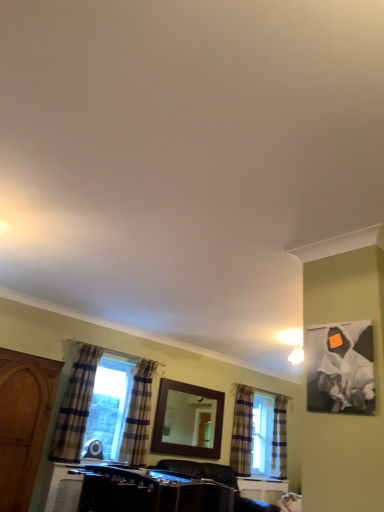
What is the approximate height of plaid fabric curtain at right, which ranks as the 4th curtain in left-to-right order?

4.26 feet.

What do you see at coordinates (340, 368) in the screenshot? I see `black canvas painting at upper right` at bounding box center [340, 368].

In order to face plaid fabric curtain at right, acting as the 3th curtain starting from the front, should I rotate leftwards or rightwards?

You should look right and rotate roughly 6.992 degrees.

I want to click on wooden mirror at center, so click(x=189, y=420).

The width and height of the screenshot is (384, 512). What do you see at coordinates (23, 422) in the screenshot?
I see `wooden cabinet at left` at bounding box center [23, 422].

Describe the element at coordinates (133, 490) in the screenshot. I see `black glossy vanity at lower center` at that location.

Where is `plaid fabric curtain at right, acting as the 1th curtain starting from the right`? Image resolution: width=384 pixels, height=512 pixels. plaid fabric curtain at right, acting as the 1th curtain starting from the right is located at coordinates (279, 438).

Which of these two, plaid fabric curtain at left, which is the 4th curtain in back-to-front order, or wooden cabinet at left, stands taller?

Answer: wooden cabinet at left is taller.

Considering the sizes of plaid fabric curtain at left, which ranks as the first curtain in front-to-back order, and wooden cabinet at left in the image, is plaid fabric curtain at left, which ranks as the first curtain in front-to-back order, wider or thinner than wooden cabinet at left?

Considering their sizes, plaid fabric curtain at left, which ranks as the first curtain in front-to-back order, looks slimmer than wooden cabinet at left.

Locate an element on the screen. The width and height of the screenshot is (384, 512). cabinetry beneath the plaid fabric curtain at left, which is counted as the 4th curtain, starting from the right (from a real-world perspective) is located at coordinates (23, 422).

Can you see plaid fabric curtain at left, which is the 4th curtain in back-to-front order, touching wooden cabinet at left?

No, plaid fabric curtain at left, which is the 4th curtain in back-to-front order, is not touching wooden cabinet at left.

Is plaid fabric curtain at right, the first curtain when ordered from back to front, next to wooden cabinet at left and touching it?

They are not placed beside each other.

From the image's perspective, which one is positioned lower, plaid fabric curtain at right, the first curtain when ordered from back to front, or wooden cabinet at left?

plaid fabric curtain at right, the first curtain when ordered from back to front, appears lower in the image.

Is the position of plaid fabric curtain at right, which ranks as the 4th curtain in left-to-right order, less distant than that of wooden cabinet at left?

No, plaid fabric curtain at right, which ranks as the 4th curtain in left-to-right order, is further to the viewer.

Considering the relative positions of plaid fabric curtain at right, the first curtain when ordered from back to front, and wooden cabinet at left in the image provided, is plaid fabric curtain at right, the first curtain when ordered from back to front, to the right of wooden cabinet at left from the viewer's perspective?

Yes.

Is point (235, 477) farther from viewer compared to point (5, 466)?

Yes, it is.

Would you say wooden cabinet at left is part of leather couch at center's contents?

Definitely not — wooden cabinet at left is not inside leather couch at center.

From the image's perspective, would you say leather couch at center is positioned over wooden cabinet at left?

No, from the image's perspective, leather couch at center is not above wooden cabinet at left.

What's the angular difference between leather couch at center and wooden cabinet at left's facing directions?

leather couch at center and wooden cabinet at left are facing 0.468 degrees away from each other.

Between wooden mirror at center and plaid fabric curtain at right, acting as the third curtain starting from the left, which one has less height?

wooden mirror at center is shorter.

Does wooden mirror at center turn towards plaid fabric curtain at right, the 2th curtain from the back?

No, wooden mirror at center is not facing towards plaid fabric curtain at right, the 2th curtain from the back.

Can we say wooden mirror at center lies outside plaid fabric curtain at right, the 2th curtain from the back?

Yes, wooden mirror at center is not within plaid fabric curtain at right, the 2th curtain from the back.

Does wooden mirror at center have a smaller size compared to plaid fabric curtain at right, the 2th curtain from the back?

Indeed, wooden mirror at center has a smaller size compared to plaid fabric curtain at right, the 2th curtain from the back.

This screenshot has width=384, height=512. I want to click on furniture located below the plaid fabric curtain at lower left, which is the 3th curtain from right to left (from the image's perspective), so click(x=217, y=481).

Is point (146, 425) in front of point (223, 483)?

That is False.

Which is in front, plaid fabric curtain at lower left, which is the 3th curtain from right to left, or leather couch at center?

leather couch at center is closer to the camera.

Is plaid fabric curtain at lower left, arranged as the third curtain when viewed from the back, turned away from leather couch at center?

plaid fabric curtain at lower left, arranged as the third curtain when viewed from the back, is not turned away from leather couch at center.

In the scene shown: In terms of size, does leather couch at center appear bigger or smaller than plaid fabric curtain at lower left, acting as the 2th curtain starting from the front?

leather couch at center is bigger than plaid fabric curtain at lower left, acting as the 2th curtain starting from the front.

From the picture: Considering the sizes of objects leather couch at center and plaid fabric curtain at lower left, acting as the 2th curtain starting from the front, in the image provided, who is taller, leather couch at center or plaid fabric curtain at lower left, acting as the 2th curtain starting from the front,?

plaid fabric curtain at lower left, acting as the 2th curtain starting from the front.

You are a GUI agent. You are given a task and a screenshot of the screen. Output one action in this format:
    pyautogui.click(x=<x>, y=<y>)
    Task: Click on the 2nd curtain above the leather couch at center (from the image's perspective)
    Image resolution: width=384 pixels, height=512 pixels.
    Given the screenshot: What is the action you would take?
    pyautogui.click(x=138, y=415)

Is leather couch at center completely or partially outside of plaid fabric curtain at lower left, which is the 3th curtain from right to left?

Yes.

What are the coordinates of `picture frame on the right of the black glossy vanity at lower center` in the screenshot? It's located at (340, 368).

Which object is positioned more to the right, black canvas painting at upper right or black glossy vanity at lower center?

black canvas painting at upper right is more to the right.

From a real-world perspective, which is physically below, black canvas painting at upper right or black glossy vanity at lower center?

black glossy vanity at lower center, from a real-world perspective.

Between black canvas painting at upper right and black glossy vanity at lower center, which one has smaller size?

black canvas painting at upper right.

This screenshot has width=384, height=512. What are the coordinates of `cabinetry directly beneath the plaid fabric curtain at left, which ranks as the first curtain in front-to-back order (from a real-world perspective)` in the screenshot? It's located at (23, 422).

You are a GUI agent. You are given a task and a screenshot of the screen. Output one action in this format:
    pyautogui.click(x=<x>, y=<y>)
    Task: Click on the cabinetry on the left of plaid fabric curtain at right, the 4th curtain viewed from the front
    This screenshot has height=512, width=384.
    Given the screenshot: What is the action you would take?
    coord(23,422)

Estimate the real-world distances between objects in this image. Which object is closer to wooden cabinet at left, black glossy vanity at lower center or plaid fabric curtain at right, the second curtain in the right-to-left sequence?

black glossy vanity at lower center.

When comparing their distances from plaid fabric curtain at lower left, acting as the 2th curtain starting from the front, does plaid fabric curtain at right, acting as the 3th curtain starting from the front, or plaid fabric curtain at right, the first curtain when ordered from back to front, seem closer?

Based on the image, plaid fabric curtain at right, acting as the 3th curtain starting from the front, appears to be nearer to plaid fabric curtain at lower left, acting as the 2th curtain starting from the front.

Which object lies nearer to the anchor point black glossy vanity at lower center, plaid fabric curtain at right, the first curtain when ordered from back to front, or wooden cabinet at left?

The object closer to black glossy vanity at lower center is wooden cabinet at left.

Based on their spatial positions, is leather couch at center or plaid fabric curtain at right, the 4th curtain viewed from the front, further from plaid fabric curtain at lower left, acting as the 2th curtain starting from the front?

The object further to plaid fabric curtain at lower left, acting as the 2th curtain starting from the front, is plaid fabric curtain at right, the 4th curtain viewed from the front.

When comparing their distances from leather couch at center, does plaid fabric curtain at lower left, which is the 3th curtain from right to left, or wooden cabinet at left seem closer?

Based on the image, plaid fabric curtain at lower left, which is the 3th curtain from right to left, appears to be nearer to leather couch at center.

Based on their spatial positions, is black canvas painting at upper right or leather couch at center further from wooden cabinet at left?

black canvas painting at upper right lies further to wooden cabinet at left than the other object.

Which object lies further to the anchor point plaid fabric curtain at lower left, acting as the 2th curtain starting from the front, plaid fabric curtain at left, which ranks as the first curtain in front-to-back order, or wooden mirror at center?

plaid fabric curtain at left, which ranks as the first curtain in front-to-back order, is positioned further to the anchor plaid fabric curtain at lower left, acting as the 2th curtain starting from the front.

Estimate the real-world distances between objects in this image. Which object is closer to leather couch at center, black canvas painting at upper right or plaid fabric curtain at left, the 1th curtain positioned from the left?

Among the two, plaid fabric curtain at left, the 1th curtain positioned from the left, is located nearer to leather couch at center.

I want to click on mirror between leather couch at center and plaid fabric curtain at right, the second curtain in the right-to-left sequence, from front to back, so [x=189, y=420].

The image size is (384, 512). In order to click on mirror between plaid fabric curtain at left, which ranks as the first curtain in front-to-back order, and plaid fabric curtain at right, the 2th curtain from the back, in the horizontal direction in this screenshot , I will do `click(189, 420)`.

I want to click on vanity positioned between black canvas painting at upper right and wooden mirror at center from near to far, so click(133, 490).

This screenshot has width=384, height=512. Identify the location of mirror between black glossy vanity at lower center and plaid fabric curtain at right, which ranks as the 4th curtain in left-to-right order, along the z-axis. (189, 420).